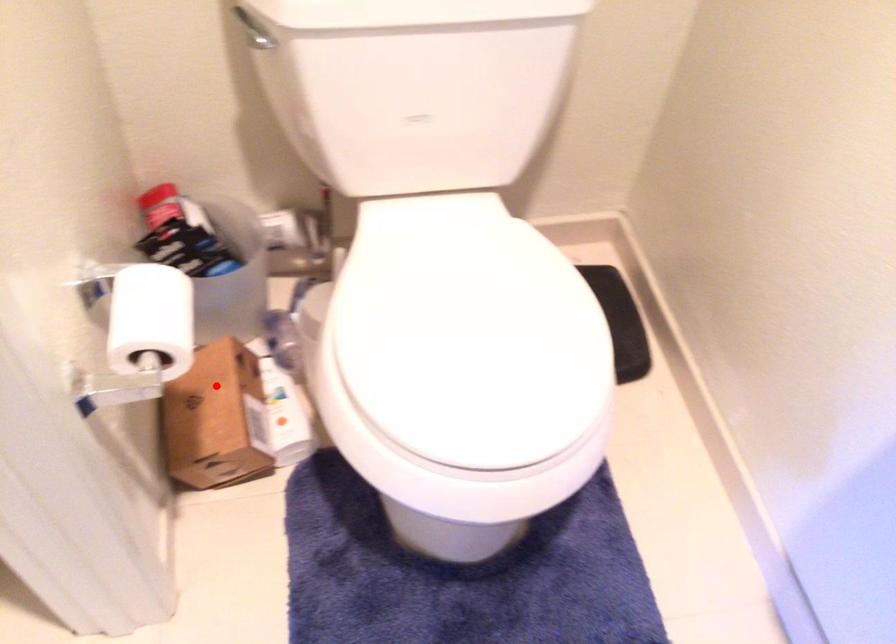
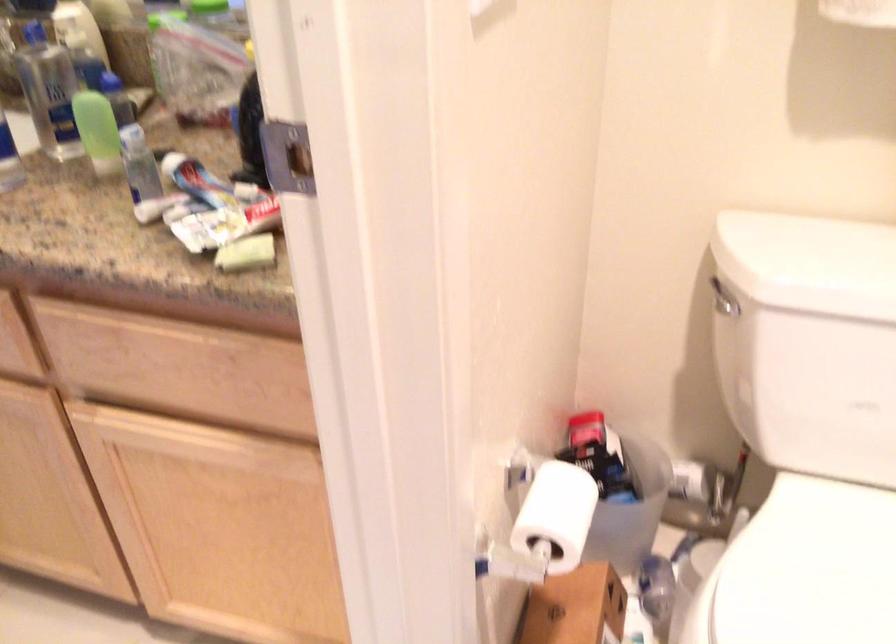
The point at the highlighted location is marked in the first image. Where is the corresponding point in the second image?

(574, 608)